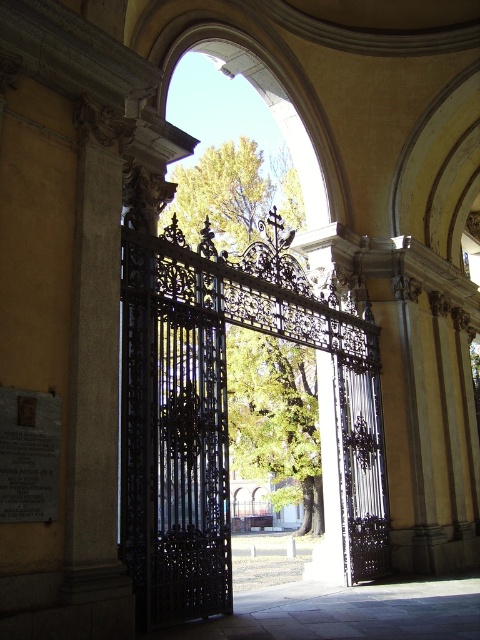
Question: Is black wrought iron gate at center to the left of smooth stone pillar at left from the viewer's perspective?

Choices:
 (A) no
 (B) yes

Answer: (A)

Question: Which point appears farthest from the camera in this image?

Choices:
 (A) (74, 513)
 (B) (173, 289)

Answer: (B)

Question: Which point is closer to the camera taking this photo?

Choices:
 (A) (237, 314)
 (B) (98, 276)

Answer: (B)

Question: Can you confirm if black wrought iron gate at center is positioned to the right of smooth stone pillar at left?

Choices:
 (A) no
 (B) yes

Answer: (B)

Question: In this image, where is black wrought iron gate at center located relative to smooth stone pillar at left?

Choices:
 (A) right
 (B) left

Answer: (A)

Question: Which point is closer to the camera taking this photo?

Choices:
 (A) (147, 292)
 (B) (121, 586)

Answer: (B)